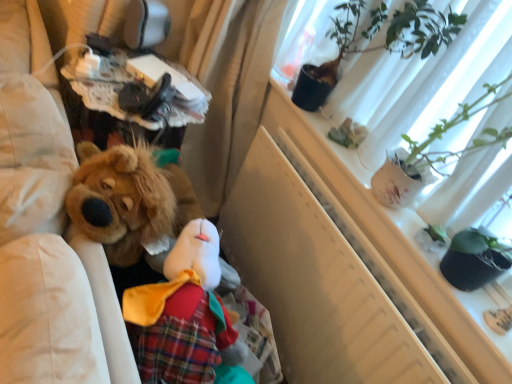
Question: From the image's perspective, does green leafy plant at upper right appear higher than white matte window screen at upper right?

Choices:
 (A) yes
 (B) no

Answer: (A)

Question: Is green leafy plant at upper right positioned behind white matte window screen at upper right?

Choices:
 (A) no
 (B) yes

Answer: (B)

Question: From the image's perspective, is green leafy plant at upper right under white matte window screen at upper right?

Choices:
 (A) no
 (B) yes

Answer: (A)

Question: Does green leafy plant at upper right have a lesser width compared to white matte window screen at upper right?

Choices:
 (A) no
 (B) yes

Answer: (B)

Question: Is green leafy plant at upper right to the right of white matte window screen at upper right from the viewer's perspective?

Choices:
 (A) no
 (B) yes

Answer: (A)

Question: Does green leafy plant at upper right have a greater height compared to white matte window screen at upper right?

Choices:
 (A) no
 (B) yes

Answer: (A)

Question: Is white matte window screen at upper right next to green leafy plant at upper right?

Choices:
 (A) no
 (B) yes

Answer: (A)

Question: Does white matte window screen at upper right come in front of green leafy plant at upper right?

Choices:
 (A) no
 (B) yes

Answer: (B)

Question: Is white matte window screen at upper right outside green leafy plant at upper right?

Choices:
 (A) no
 (B) yes

Answer: (B)

Question: From the image's perspective, is white matte window screen at upper right located above green leafy plant at upper right?

Choices:
 (A) yes
 (B) no

Answer: (B)

Question: Can you confirm if white matte window screen at upper right is positioned to the right of green leafy plant at upper right?

Choices:
 (A) yes
 (B) no

Answer: (A)

Question: From the image's perspective, is white matte window screen at upper right located beneath green leafy plant at upper right?

Choices:
 (A) yes
 (B) no

Answer: (A)

Question: Considering the positions of green leafy plant at upper right and white matte window screen at upper right in the image, is green leafy plant at upper right wider or thinner than white matte window screen at upper right?

Choices:
 (A) wide
 (B) thin

Answer: (B)